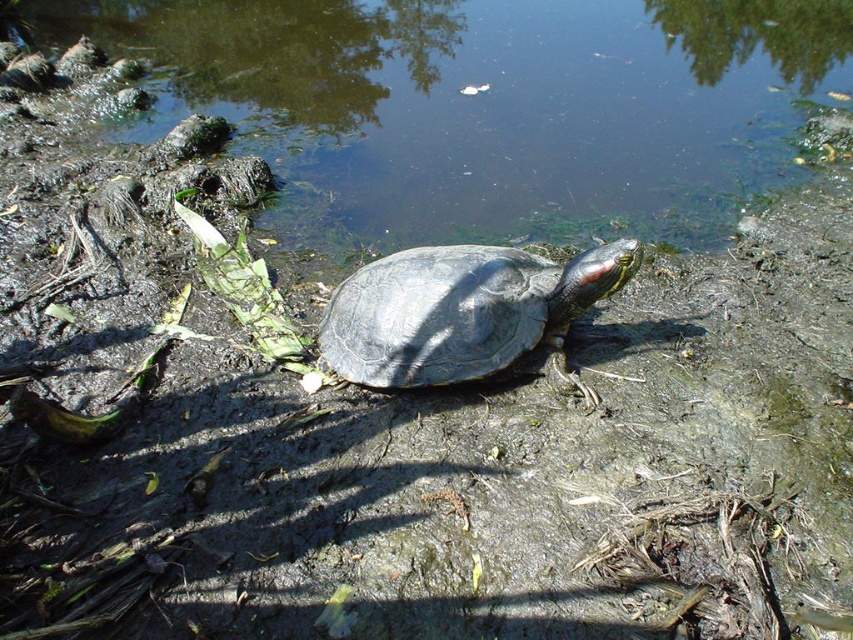
Question: Which object is closer to the camera taking this photo?

Choices:
 (A) greenish murky water at center
 (B) shiny dark gray tortoise at center

Answer: (B)

Question: In this image, where is greenish murky water at center located relative to shiny dark gray tortoise at center?

Choices:
 (A) below
 (B) above

Answer: (B)

Question: Is greenish murky water at center above shiny dark gray tortoise at center?

Choices:
 (A) yes
 (B) no

Answer: (A)

Question: Observing the image, what is the correct spatial positioning of greenish murky water at center in reference to shiny dark gray tortoise at center?

Choices:
 (A) right
 (B) left

Answer: (B)

Question: Which object is closer to the camera taking this photo?

Choices:
 (A) greenish murky water at center
 (B) shiny dark gray tortoise at center

Answer: (B)